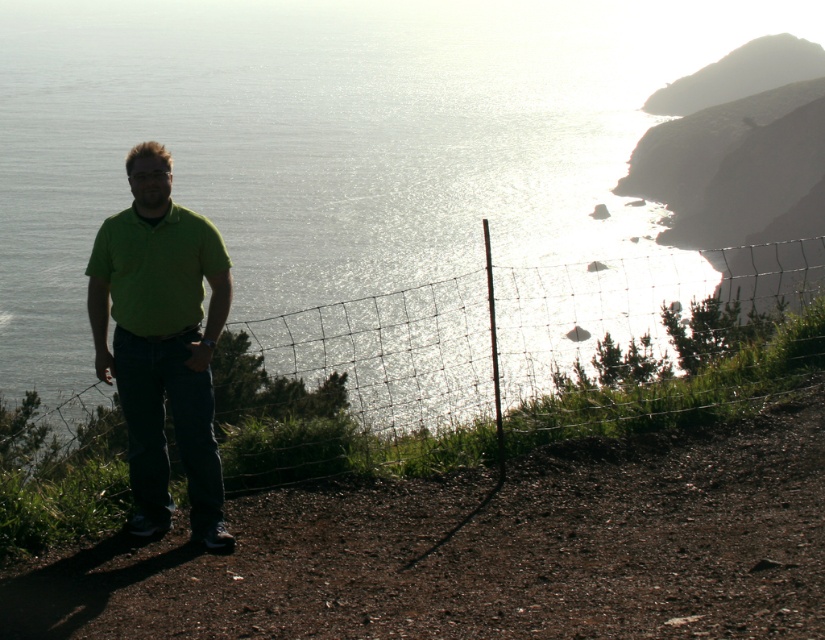
Question: Which point is closer to the camera?

Choices:
 (A) glistening silver water at center
 (B) green matte shirt at center

Answer: (B)

Question: Which is nearer to the green matte shirt at center?

Choices:
 (A) glistening silver water at center
 (B) green grass at lower left

Answer: (B)

Question: Considering the relative positions of glistening silver water at center and green matte shirt at center in the image provided, where is glistening silver water at center located with respect to green matte shirt at center?

Choices:
 (A) below
 (B) above

Answer: (B)

Question: Is the position of glistening silver water at center more distant than that of green grass at lower left?

Choices:
 (A) yes
 (B) no

Answer: (A)

Question: Can you confirm if glistening silver water at center is positioned above green grass at lower left?

Choices:
 (A) yes
 (B) no

Answer: (A)

Question: Estimate the real-world distances between objects in this image. Which object is closer to the green matte shirt at center?

Choices:
 (A) green grass at lower left
 (B) glistening silver water at center

Answer: (A)